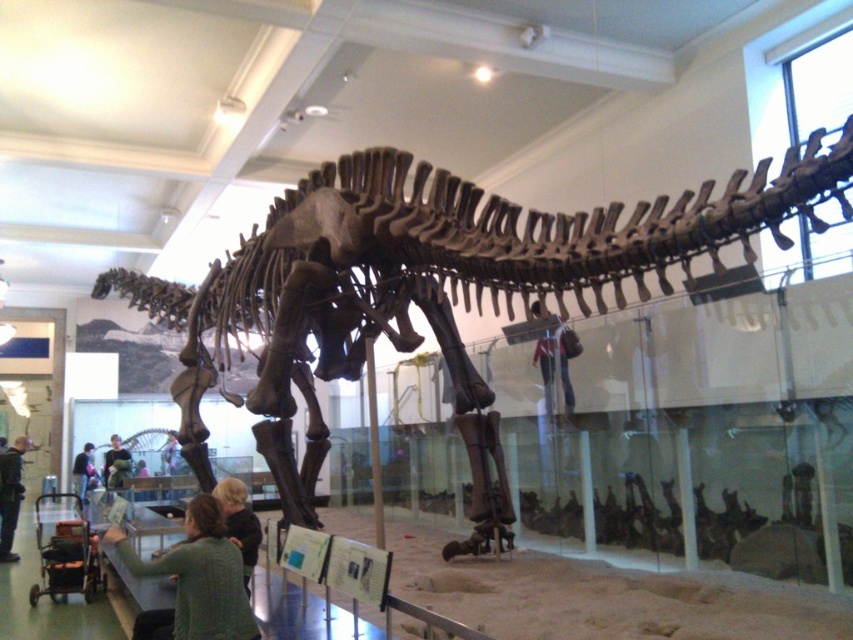
You are a museum visitor standing in front of the dinosaur skeleton. You notice two items in the scene, the denim jacket at center and the green fabric shirt at lower left. Which item is taller?

The denim jacket at center is much taller than the green fabric shirt at lower left.

You are a visitor at the museum and see the denim jacket at center and the dark green sweater at lower left. Which clothing item is placed higher up compared to the other?

The denim jacket at center is positioned over the dark green sweater at lower left, meaning it is placed higher up.

You are standing in a museum and see the denim jacket at center displayed near the dinosaur skeleton. If you want to touch the jacket, will you be able to reach it without moving closer?

The denim jacket at center is 6.45 meters away from the viewer, so you cannot reach it without moving closer.